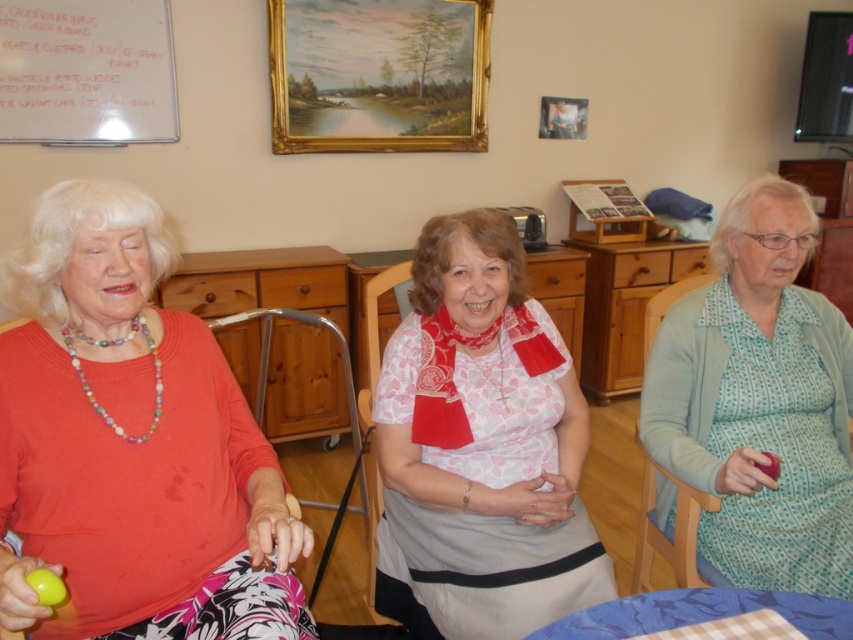
You are a tailor measuring garments for alterations. You have a light blue dotted cardigan at right and a wooden picture frame at upper center in front of you. Which item is taller?

The light blue dotted cardigan at right is taller than the wooden picture frame at upper center according to the description.

You are standing in the room and want to hand a gift to the woman wearing the matte orange sweater at left. Based on the coordinates provided, where should you approach her from?

The matte orange sweater at left is located at coordinates point (131, 444). To approach her, you should come from the direction corresponding to these coordinates.